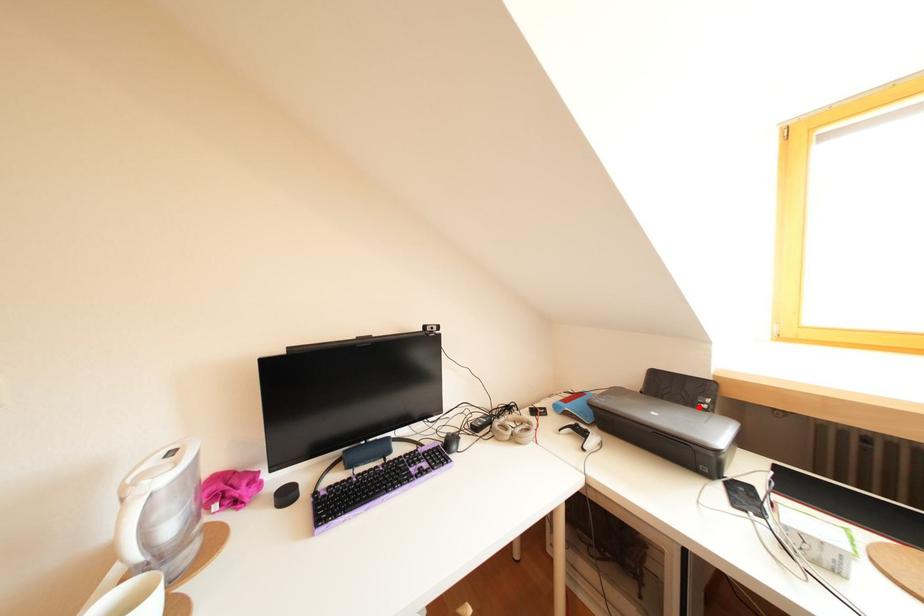
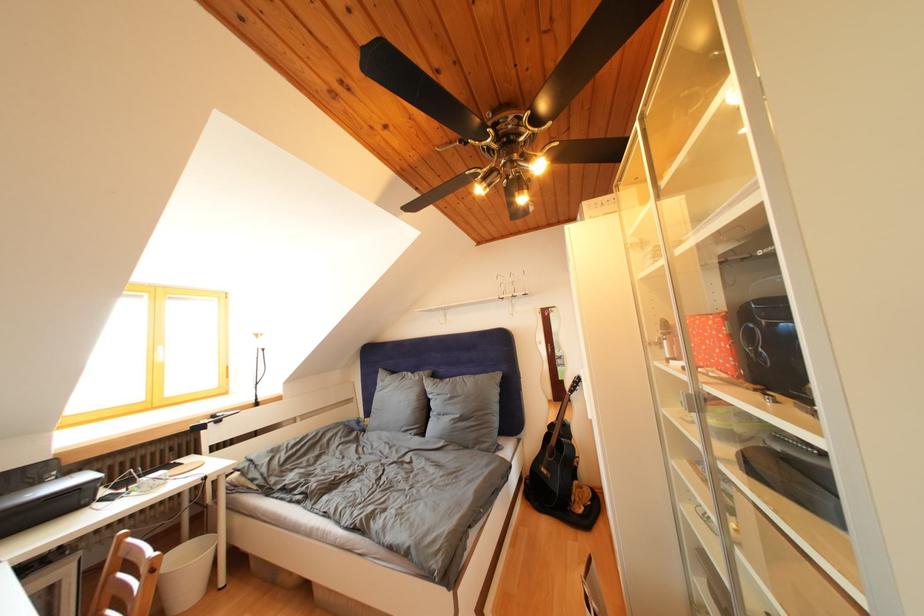
Question: I am providing you with two images of the same scene from different viewpoints. In image1, a red point is highlighted. Considering the same 3D point in image2, which of the following is correct?

Choices:
 (A) It is closer
 (B) It is farther

Answer: (A)